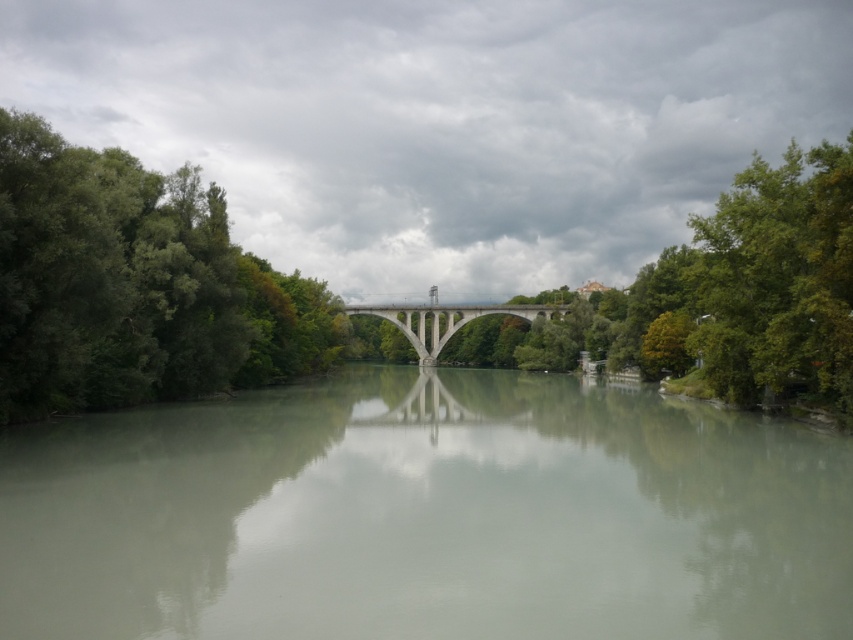
Question: Does clear water at center have a larger size compared to green leafy tree at center?

Choices:
 (A) yes
 (B) no

Answer: (B)

Question: Which of these objects is positioned farthest from the green leafy trees at left?

Choices:
 (A) concrete bridge at center
 (B) clear water at center
 (C) green leafy tree at center

Answer: (A)

Question: Which object is farther from the camera taking this photo?

Choices:
 (A) clear water at center
 (B) green leafy tree at center
 (C) concrete bridge at center
 (D) green leafy trees at left

Answer: (C)

Question: Can you confirm if green leafy tree at center is positioned above concrete bridge at center?

Choices:
 (A) no
 (B) yes

Answer: (B)

Question: Which of the following is the farthest from the observer?

Choices:
 (A) clear water at center
 (B) green leafy tree at center

Answer: (B)

Question: Where is clear water at center located in relation to green leafy tree at center in the image?

Choices:
 (A) left
 (B) right

Answer: (A)